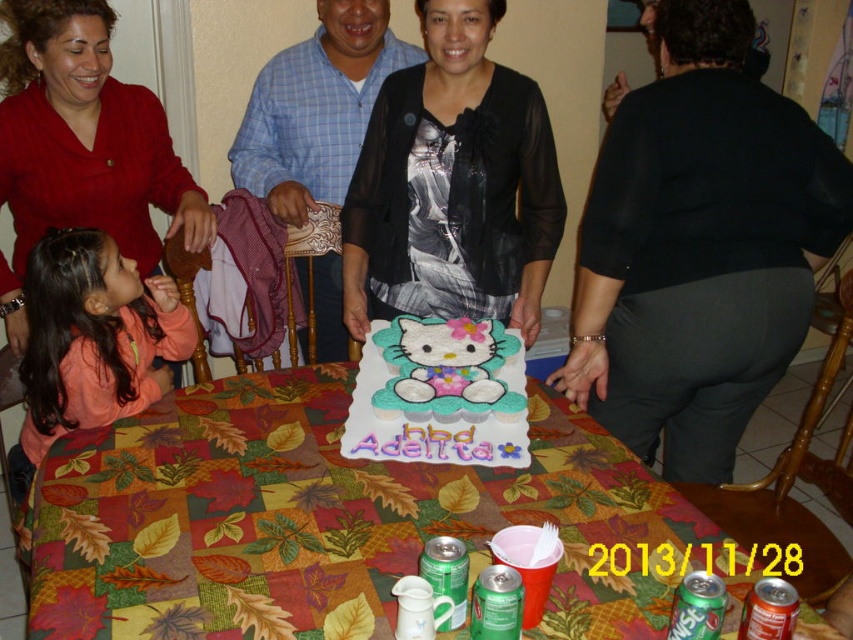
You are a guest at the birthday party and want to place a gift on the table. Where should you place it to ensure it is on the multicolored fabric tablecloth at center?

Place the gift at the coordinates (337, 522) to ensure it is on the multicolored fabric tablecloth at center.

Based on the photo, you are a guest at the birthday party and want to grab the metallic red soda can at lower right. However, you are currently holding the black sheer blouse at center. Can you reach the soda can without letting go of the blouse?

The black sheer blouse at center is to the left of metallic red soda can at lower right, so you can reach the soda can by moving your other hand towards the right side while holding the blouse.